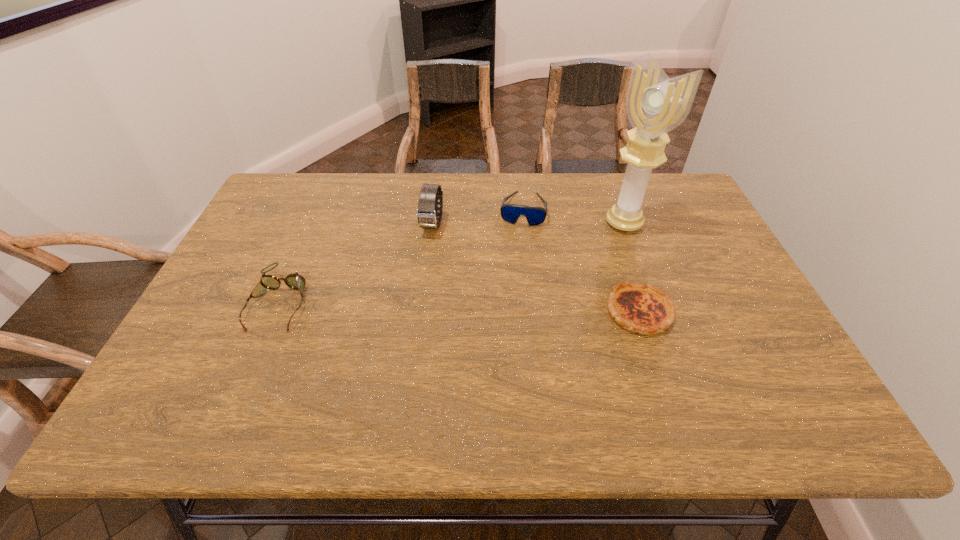
Find the location of a particular element. The width and height of the screenshot is (960, 540). object that is the third closest to the second tallest object is located at coordinates coord(643,308).

Locate an element on the screen. This screenshot has height=540, width=960. object that can be found as the third closest to the quiche is located at coordinates (427, 212).